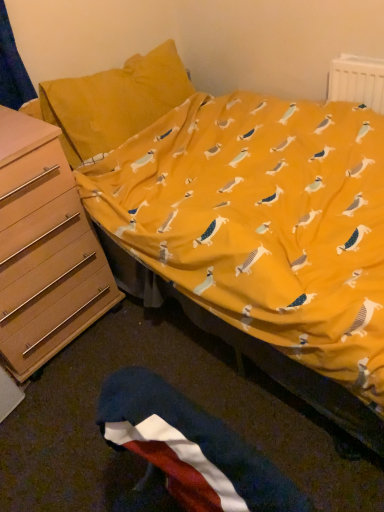
Question: Should I look upward or downward to see white plastic radiator at upper right?

Choices:
 (A) down
 (B) up

Answer: (B)

Question: Is polyester flag at lower center positioned beyond the bounds of light brown wooden chest of drawers at left?

Choices:
 (A) no
 (B) yes

Answer: (B)

Question: Can you confirm if polyester flag at lower center is wider than light brown wooden chest of drawers at left?

Choices:
 (A) yes
 (B) no

Answer: (B)

Question: Does polyester flag at lower center have a lesser width compared to light brown wooden chest of drawers at left?

Choices:
 (A) no
 (B) yes

Answer: (B)

Question: Considering the relative positions of polyester flag at lower center and light brown wooden chest of drawers at left in the image provided, is polyester flag at lower center to the left of light brown wooden chest of drawers at left from the viewer's perspective?

Choices:
 (A) yes
 (B) no

Answer: (B)

Question: From the image's perspective, is polyester flag at lower center below light brown wooden chest of drawers at left?

Choices:
 (A) no
 (B) yes

Answer: (B)

Question: Is polyester flag at lower center shorter than light brown wooden chest of drawers at left?

Choices:
 (A) yes
 (B) no

Answer: (A)

Question: Is light brown wooden chest of drawers at left closer to the viewer compared to white plastic radiator at upper right?

Choices:
 (A) no
 (B) yes

Answer: (B)

Question: Considering the relative sizes of light brown wooden chest of drawers at left and white plastic radiator at upper right in the image provided, is light brown wooden chest of drawers at left thinner than white plastic radiator at upper right?

Choices:
 (A) yes
 (B) no

Answer: (B)

Question: From the image's perspective, is light brown wooden chest of drawers at left below white plastic radiator at upper right?

Choices:
 (A) no
 (B) yes

Answer: (B)

Question: From the image's perspective, is light brown wooden chest of drawers at left located above white plastic radiator at upper right?

Choices:
 (A) no
 (B) yes

Answer: (A)

Question: Does light brown wooden chest of drawers at left have a lesser height compared to white plastic radiator at upper right?

Choices:
 (A) no
 (B) yes

Answer: (A)

Question: Is light brown wooden chest of drawers at left completely or partially outside of white plastic radiator at upper right?

Choices:
 (A) no
 (B) yes

Answer: (B)

Question: Is light brown wooden chest of drawers at left thinner than polyester flag at lower center?

Choices:
 (A) no
 (B) yes

Answer: (A)